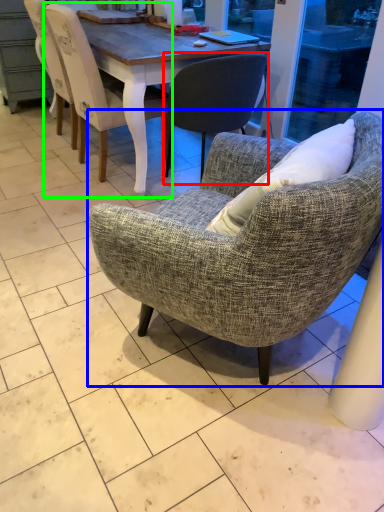
Question: Considering the real-world distances, which object is closest to chair (highlighted by a red box)? chair (highlighted by a blue box) or chair (highlighted by a green box).

Choices:
 (A) chair
 (B) chair

Answer: (B)